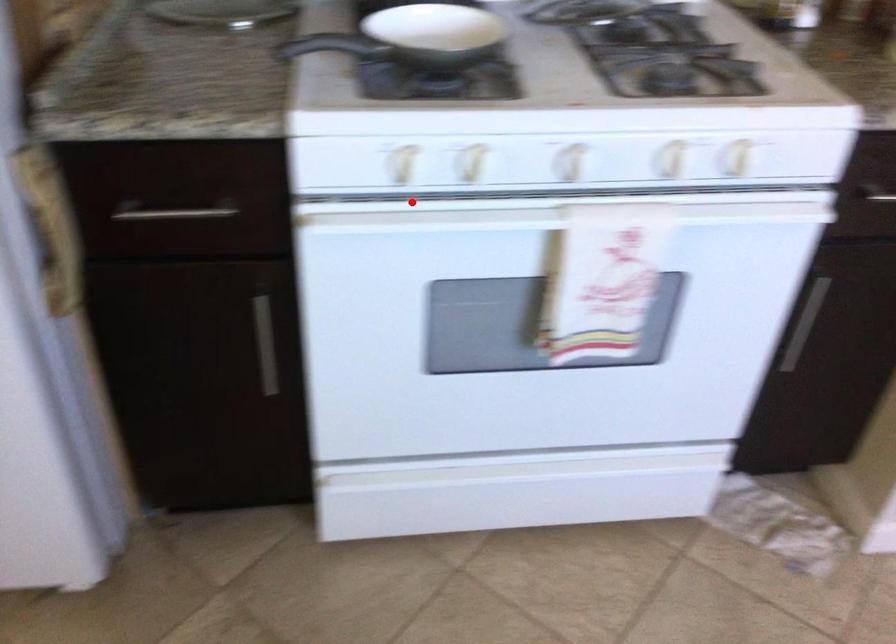
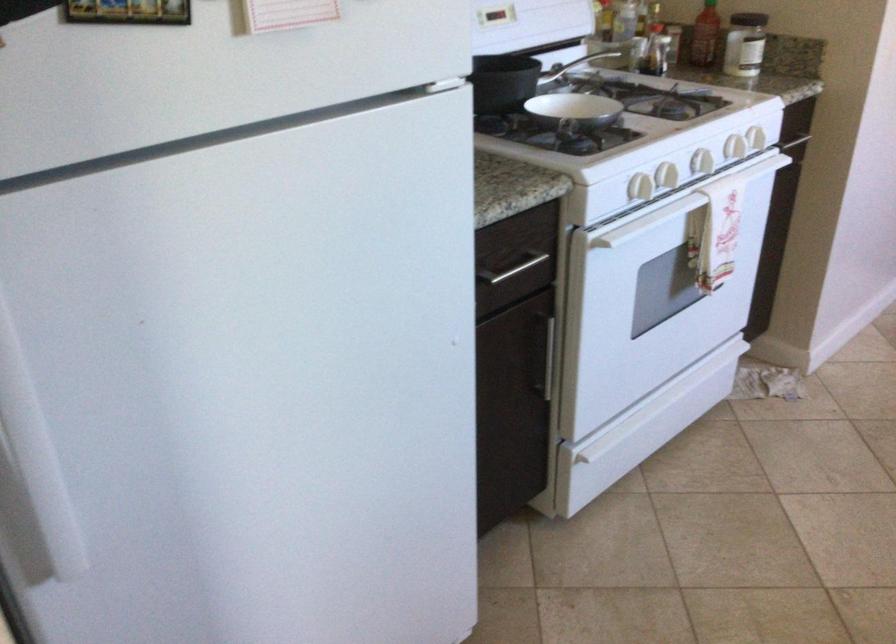
Question: I am providing you with two images of the same scene from different viewpoints. In image1, a red point is highlighted. Considering the same 3D point in image2, which of the following is correct?

Choices:
 (A) It is closer
 (B) It is farther

Answer: (B)